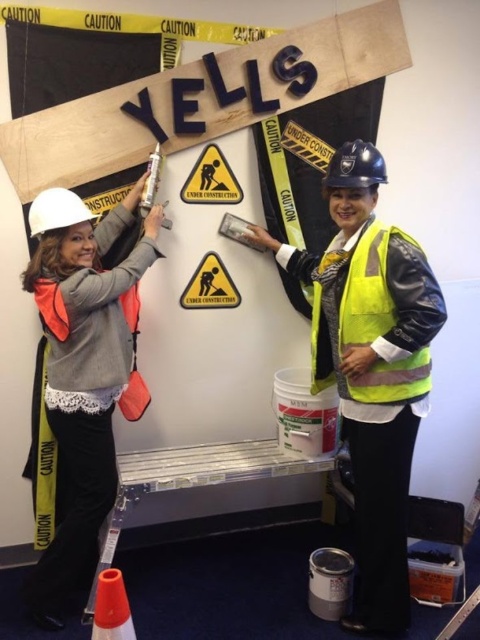
Does white matte hard hat at left come behind orange reflective cone at lower left?

Yes, white matte hard hat at left is behind orange reflective cone at lower left.

Can you confirm if white matte hard hat at left is taller than orange reflective cone at lower left?

Yes, white matte hard hat at left is taller than orange reflective cone at lower left.

At what (x,y) coordinates should I click in order to perform the action: click on white matte hard hat at left. Please return your answer as a coordinate pair (x, y). The width and height of the screenshot is (480, 640). Looking at the image, I should click on (82, 368).

Image resolution: width=480 pixels, height=640 pixels. I want to click on white matte hard hat at left, so click(82, 368).

Is yellow reflective safety vest at center shorter than yellowmaterial/texturewarning sign at center?

No.

Is point (382, 385) farther from viewer compared to point (182, 300)?

No, it is not.

The image size is (480, 640). Find the location of `yellow reflective safety vest at center`. yellow reflective safety vest at center is located at coordinates (368, 289).

Does white matte hard hat at left have a smaller size compared to yellow reflective safety vest at center?

No, white matte hard hat at left is not smaller than yellow reflective safety vest at center.

Is white matte hard hat at left further to the viewer compared to yellow reflective safety vest at center?

Yes.

Who is more distant from viewer, (69,216) or (350,294)?

The point (69,216) is behind.

At what (x,y) coordinates should I click in order to perform the action: click on white matte hard hat at left. Please return your answer as a coordinate pair (x, y). Looking at the image, I should click on (82, 368).